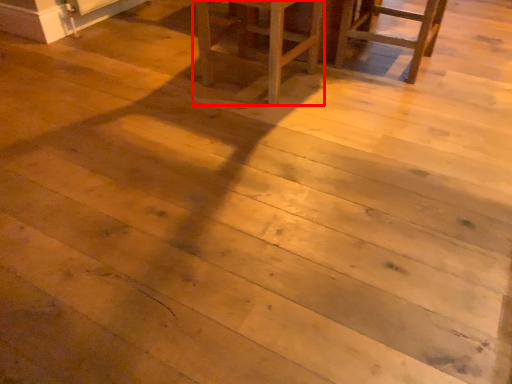
Question: Considering the relative positions of furniture (annotated by the red box) and chair in the image provided, where is furniture (annotated by the red box) located with respect to the staircase?

Choices:
 (A) left
 (B) right

Answer: (A)